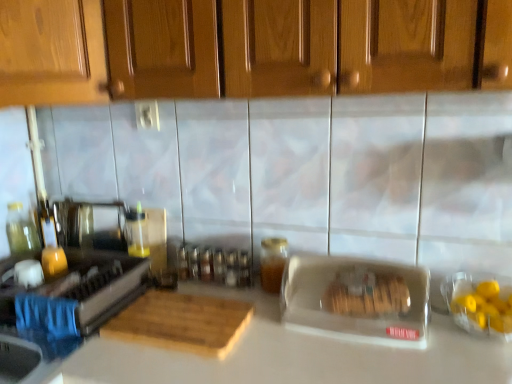
I want to click on white matte countertop at center, so click(x=297, y=355).

The height and width of the screenshot is (384, 512). What do you see at coordinates (75, 291) in the screenshot?
I see `stainless steel stove at left, arranged as the 2th appliance when viewed from the right` at bounding box center [75, 291].

Locate an element on the screen. The width and height of the screenshot is (512, 384). stainless steel stove at left, arranged as the 2th appliance when viewed from the right is located at coordinates (75, 291).

Describe the element at coordinates (181, 322) in the screenshot. This screenshot has width=512, height=384. I see `wooden cutting board at center` at that location.

Where is `wooden cabinet at upper center`? The image size is (512, 384). wooden cabinet at upper center is located at coordinates (248, 48).

At what (x,y) coordinates should I click in order to perform the action: click on white matte countertop at center. Please return your answer as a coordinate pair (x, y). Looking at the image, I should click on (297, 355).

Between wooden cutting board at center and white matte countertop at center, which one has smaller size?

wooden cutting board at center is smaller.

Can you confirm if wooden cutting board at center is taller than white matte countertop at center?

In fact, wooden cutting board at center may be shorter than white matte countertop at center.

From the picture: Is wooden cutting board at center oriented away from white matte countertop at center?

Yes, wooden cutting board at center is facing away from white matte countertop at center.

Identify the location of cutting board above the white matte countertop at center (from a real-world perspective). (181, 322).

Does clear plastic container at center, the 2th appliance positioned from the left, have a smaller size compared to wooden cutting board at center?

Actually, clear plastic container at center, the 2th appliance positioned from the left, might be larger than wooden cutting board at center.

Based on the photo, who is shorter, clear plastic container at center, the 2th appliance positioned from the left, or wooden cutting board at center?

wooden cutting board at center.

Is clear plastic container at center, acting as the first appliance starting from the right, touching wooden cutting board at center?

No.

From a real-world perspective, relative to wooden cutting board at center, is clear plastic container at center, the 2th appliance positioned from the left, vertically above or below?

clear plastic container at center, the 2th appliance positioned from the left, is situated higher than wooden cutting board at center in the real world.

Which of these two, wooden cabinet at upper center or clear plastic container at center, acting as the first appliance starting from the right, stands shorter?

clear plastic container at center, acting as the first appliance starting from the right, is shorter.

Consider the image. Could you tell me if wooden cabinet at upper center is facing clear plastic container at center, the 2th appliance positioned from the left?

No, wooden cabinet at upper center is not aimed at clear plastic container at center, the 2th appliance positioned from the left.

Is clear plastic container at center, the 2th appliance positioned from the left, located within wooden cabinet at upper center?

That's incorrect, clear plastic container at center, the 2th appliance positioned from the left, is not inside wooden cabinet at upper center.

Can you confirm if wooden cabinet at upper center is thinner than clear plastic container at center, acting as the first appliance starting from the right?

Incorrect, the width of wooden cabinet at upper center is not less than that of clear plastic container at center, acting as the first appliance starting from the right.

From a real-world perspective, who is located lower, white matte countertop at center or wooden cabinet at upper center?

In real-world perspective, white matte countertop at center is lower.

Which is behind, white matte countertop at center or wooden cabinet at upper center?

white matte countertop at center is more distant.

Can you see white matte countertop at center touching wooden cabinet at upper center?

No, white matte countertop at center is not next to wooden cabinet at upper center.

Is white matte countertop at center oriented towards wooden cabinet at upper center?

No, white matte countertop at center is not oriented towards wooden cabinet at upper center.

Is stainless steel stove at left, the 1th appliance from the left, thinner than white matte countertop at center?

Yes, stainless steel stove at left, the 1th appliance from the left, is thinner than white matte countertop at center.

From the image's perspective, which object appears higher, stainless steel stove at left, arranged as the 2th appliance when viewed from the right, or white matte countertop at center?

From the image's view, stainless steel stove at left, arranged as the 2th appliance when viewed from the right, is above.

Can you tell me how much stainless steel stove at left, arranged as the 2th appliance when viewed from the right, and white matte countertop at center differ in facing direction?

1.67 degrees.

Which point is more distant from viewer, (x=14, y=308) or (x=507, y=350)?

The point (x=14, y=308) is farther.

Who is taller, white matte countertop at center or clear plastic container at center, the 2th appliance positioned from the left?

white matte countertop at center is taller.

Does white matte countertop at center come in front of clear plastic container at center, acting as the first appliance starting from the right?

Yes, white matte countertop at center is closer to the camera.

From the image's perspective, which is below, white matte countertop at center or clear plastic container at center, the 2th appliance positioned from the left?

From the image's view, white matte countertop at center is below.

How many degrees apart are the facing directions of white matte countertop at center and clear plastic container at center, acting as the first appliance starting from the right?

The angular difference between white matte countertop at center and clear plastic container at center, acting as the first appliance starting from the right, is 1.72 degrees.

Does clear plastic container at center, the 2th appliance positioned from the left, have a lesser width compared to white matte countertop at center?

Yes, clear plastic container at center, the 2th appliance positioned from the left, is thinner than white matte countertop at center.

Image resolution: width=512 pixels, height=384 pixels. What are the coordinates of `appliance on the right of white matte countertop at center` in the screenshot? It's located at (356, 300).

Considering the relative sizes of clear plastic container at center, acting as the first appliance starting from the right, and white matte countertop at center in the image provided, is clear plastic container at center, acting as the first appliance starting from the right, bigger than white matte countertop at center?

No, clear plastic container at center, acting as the first appliance starting from the right, is not bigger than white matte countertop at center.

Between clear plastic container at center, acting as the first appliance starting from the right, and white matte countertop at center, which one is positioned behind?

Positioned behind is clear plastic container at center, acting as the first appliance starting from the right.

You are a GUI agent. You are given a task and a screenshot of the screen. Output one action in this format:
    pyautogui.click(x=<x>, y=<y>)
    Task: Click on the countertop below the wooden cutting board at center (from the image's perspective)
    This screenshot has width=512, height=384.
    Given the screenshot: What is the action you would take?
    pyautogui.click(x=297, y=355)

The width and height of the screenshot is (512, 384). I want to click on appliance that is the 2nd one when counting forward from the wooden cutting board at center, so click(356, 300).

From the image, which object appears to be farther from wooden cutting board at center, white matte countertop at center or clear plastic container at center, the 2th appliance positioned from the left?

clear plastic container at center, the 2th appliance positioned from the left, is positioned further to the anchor wooden cutting board at center.

From the picture: Estimate the real-world distances between objects in this image. Which object is closer to white matte countertop at center, wooden cabinet at upper center or wooden cutting board at center?

wooden cutting board at center lies closer to white matte countertop at center than the other object.

Considering their positions, is clear plastic container at center, the 2th appliance positioned from the left, positioned closer to wooden cutting board at center than stainless steel stove at left, the 1th appliance from the left?

Based on the image, stainless steel stove at left, the 1th appliance from the left, appears to be nearer to wooden cutting board at center.

From the image, which object appears to be farther from clear plastic container at center, acting as the first appliance starting from the right, wooden cabinet at upper center or wooden cutting board at center?

wooden cabinet at upper center is further to clear plastic container at center, acting as the first appliance starting from the right.

Looking at this image, estimate the real-world distances between objects in this image. Which object is further from stainless steel stove at left, arranged as the 2th appliance when viewed from the right, wooden cabinet at upper center or wooden cutting board at center?

Based on the image, wooden cabinet at upper center appears to be further to stainless steel stove at left, arranged as the 2th appliance when viewed from the right.

Looking at this image, estimate the real-world distances between objects in this image. Which object is further from white matte countertop at center, wooden cutting board at center or stainless steel stove at left, arranged as the 2th appliance when viewed from the right?

stainless steel stove at left, arranged as the 2th appliance when viewed from the right, is further to white matte countertop at center.

From the image, which object appears to be farther from wooden cabinet at upper center, stainless steel stove at left, arranged as the 2th appliance when viewed from the right, or wooden cutting board at center?

stainless steel stove at left, arranged as the 2th appliance when viewed from the right, lies further to wooden cabinet at upper center than the other object.

From the image, which object appears to be nearer to wooden cabinet at upper center, stainless steel stove at left, the 1th appliance from the left, or clear plastic container at center, acting as the first appliance starting from the right?

clear plastic container at center, acting as the first appliance starting from the right, lies closer to wooden cabinet at upper center than the other object.

Find the location of a particular element. This screenshot has height=384, width=512. cutting board that lies between wooden cabinet at upper center and white matte countertop at center from top to bottom is located at coordinates (181, 322).

Locate an element on the screen. The image size is (512, 384). countertop between stainless steel stove at left, the 1th appliance from the left, and clear plastic container at center, acting as the first appliance starting from the right, in the horizontal direction is located at coordinates (297, 355).

Locate an element on the screen. cabinetry situated between stainless steel stove at left, the 1th appliance from the left, and clear plastic container at center, the 2th appliance positioned from the left, from left to right is located at coordinates (248, 48).

Where is `countertop between wooden cutting board at center and clear plastic container at center, acting as the first appliance starting from the right`? The image size is (512, 384). countertop between wooden cutting board at center and clear plastic container at center, acting as the first appliance starting from the right is located at coordinates (297, 355).